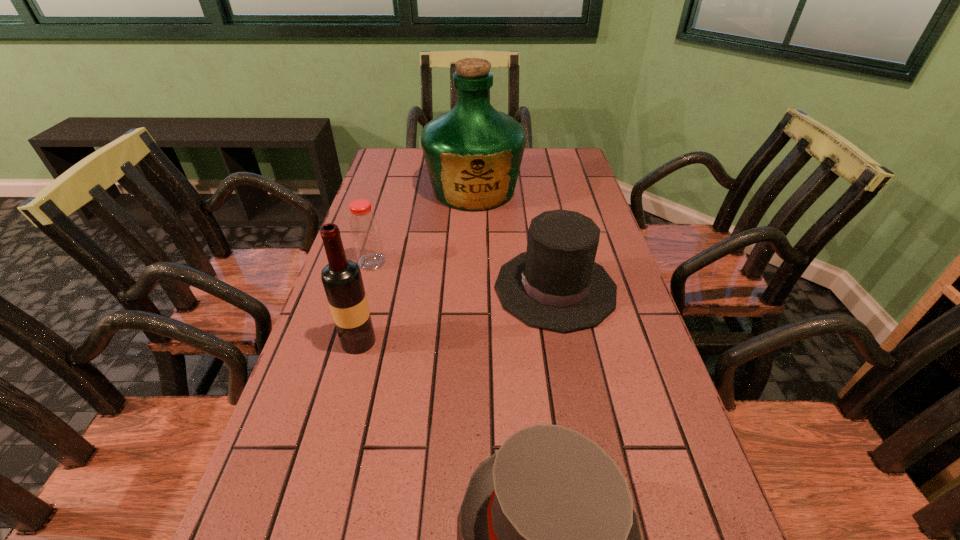
The height and width of the screenshot is (540, 960). Identify the location of free spot between the tallest object and the wine bottle. (417, 266).

Where is `vacant area that lies between the farthest object and the fourth shortest object`? The image size is (960, 540). vacant area that lies between the farthest object and the fourth shortest object is located at coordinates (417, 266).

The height and width of the screenshot is (540, 960). In order to click on the fourth closest object to the fourth shortest object in this screenshot , I will do `click(473, 153)`.

Where is `the closest object to the second tallest object`? the closest object to the second tallest object is located at coordinates (365, 232).

Locate an element on the screen. vacant space that satisfies the following two spatial constraints: 1. on the front side of the bottle; 2. on the left side of the fourth shortest object is located at coordinates (348, 341).